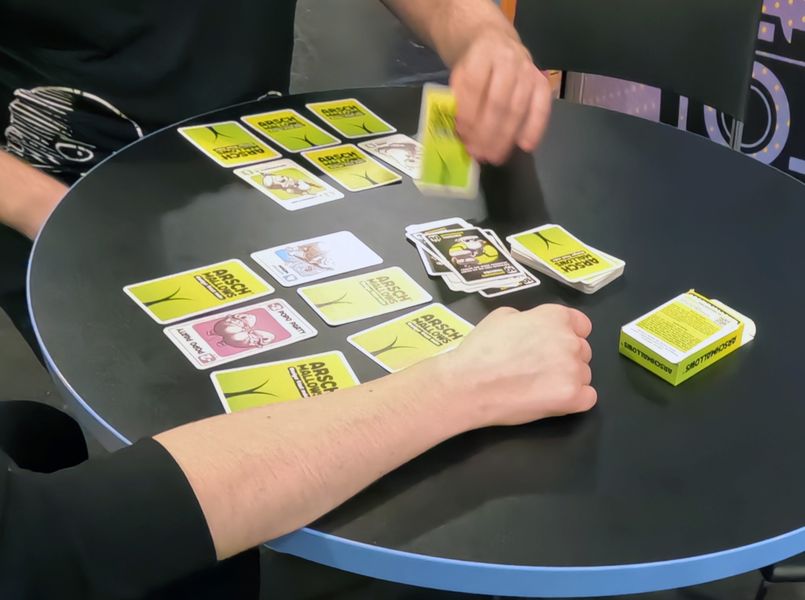
Locate an element on the screen. The image size is (805, 600). purple wall background is located at coordinates (625, 98).